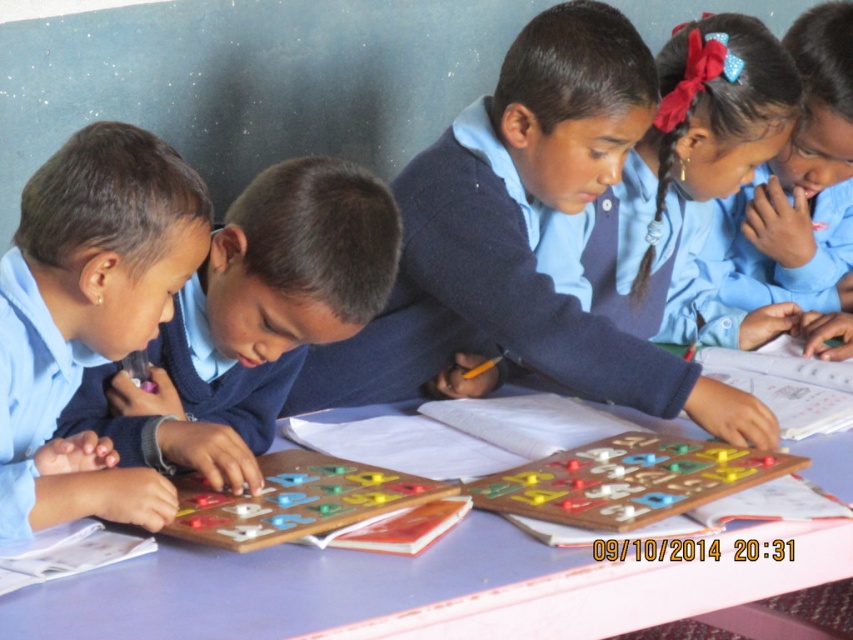
You are a teacher organizing a classroom activity. You have a purple plastic table at center and a wooden game board at center. Which object should you place a large educational poster on to ensure it fits properly?

The purple plastic table at center is bigger than the wooden game board at center, so the poster should be placed on the purple plastic table at center to ensure it fits properly.